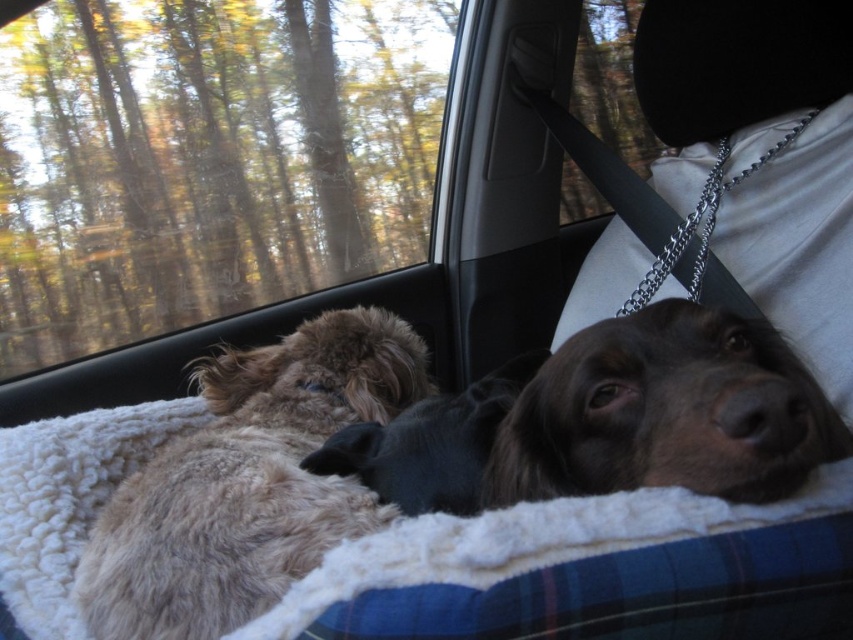
Between point (253, 540) and point (408, 406), which one is positioned behind?

The point (408, 406) is more distant.

Can you confirm if fuzzy brown dog at center is wider than brown fuzzy dog at center?

Indeed, fuzzy brown dog at center has a greater width compared to brown fuzzy dog at center.

Which is in front, point (253, 554) or point (407, 440)?

Point (253, 554)

At what (x,y) coordinates should I click in order to perform the action: click on fuzzy brown dog at center. Please return your answer as a coordinate pair (x, y). This screenshot has width=853, height=640. Looking at the image, I should click on (248, 483).

Is white fleece dog bed at center closer to the viewer compared to brown furry dog at center?

No, white fleece dog bed at center is further to the viewer.

Does white fleece dog bed at center have a lesser height compared to brown furry dog at center?

Indeed, white fleece dog bed at center has a lesser height compared to brown furry dog at center.

Locate an element on the screen. Image resolution: width=853 pixels, height=640 pixels. white fleece dog bed at center is located at coordinates (527, 541).

How much distance is there between fuzzy brown dog at center and white fleece dog bed at center?

fuzzy brown dog at center is 18.75 centimeters from white fleece dog bed at center.

Measure the distance between point (207, 372) and camera.

The distance of point (207, 372) from camera is 3.65 feet.

What are the coordinates of `fuzzy brown dog at center` in the screenshot? It's located at (248, 483).